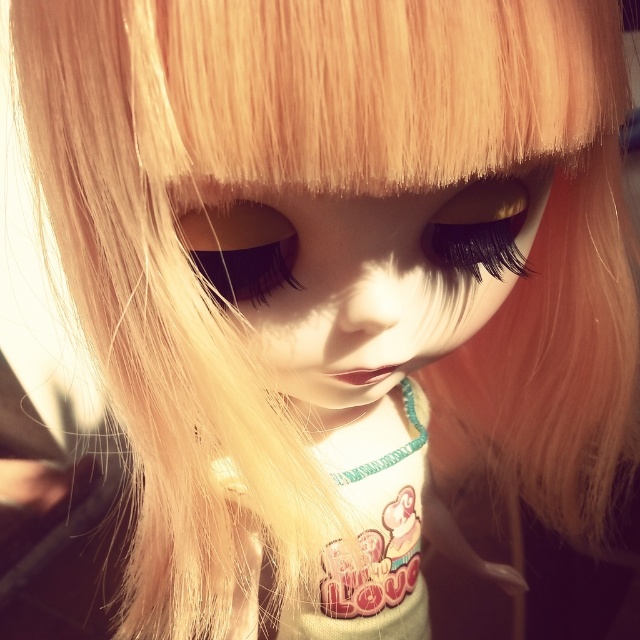
Image resolution: width=640 pixels, height=640 pixels. Identify the location of satin blonde hair at center. (364, 278).

Is point (372, 376) positioned after point (465, 227)?

Yes, it is.

What are the coordinates of `satin blonde hair at center` in the screenshot? It's located at (364, 278).

Who is taller, satin black eye at center or black matte eyelashes at upper center?

black matte eyelashes at upper center

Is satin black eye at center thinner than black matte eyelashes at upper center?

Correct, satin black eye at center's width is less than black matte eyelashes at upper center's.

This screenshot has width=640, height=640. In order to click on satin black eye at center in this screenshot , I will do (241, 248).

You are a GUI agent. You are given a task and a screenshot of the screen. Output one action in this format:
    pyautogui.click(x=<x>, y=<y>)
    Task: Click on the satin black eye at center
    The image size is (640, 640).
    Given the screenshot: What is the action you would take?
    pyautogui.click(x=241, y=248)

Which is behind, point (545, 179) or point (220, 218)?

The point (545, 179) is behind.

The image size is (640, 640). I want to click on satin blonde hair at center, so click(364, 278).

Identify the location of satin blonde hair at center. [x=364, y=278].

This screenshot has width=640, height=640. I want to click on satin blonde hair at center, so click(364, 278).